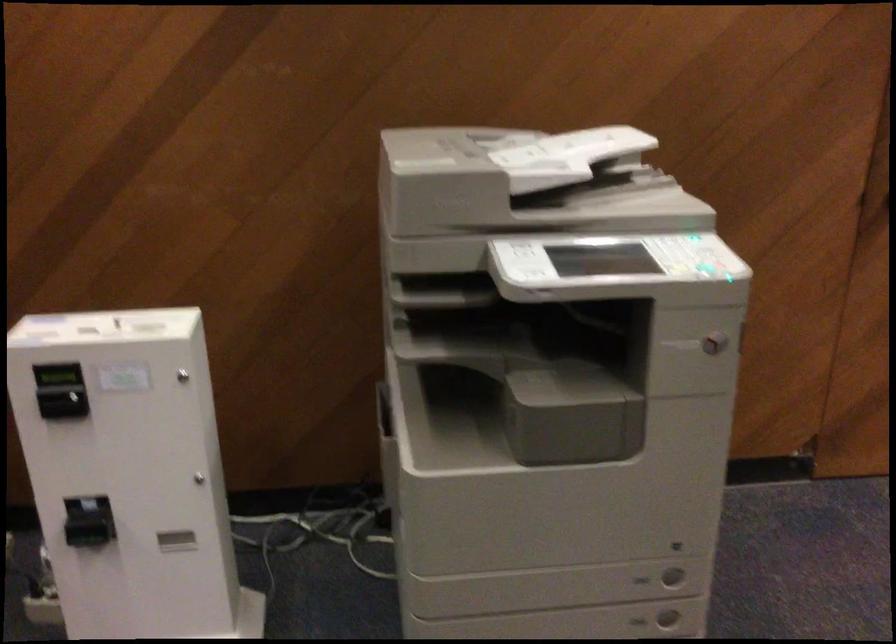
Where is `printer key lock`? The height and width of the screenshot is (644, 896). printer key lock is located at coordinates pyautogui.click(x=713, y=343).